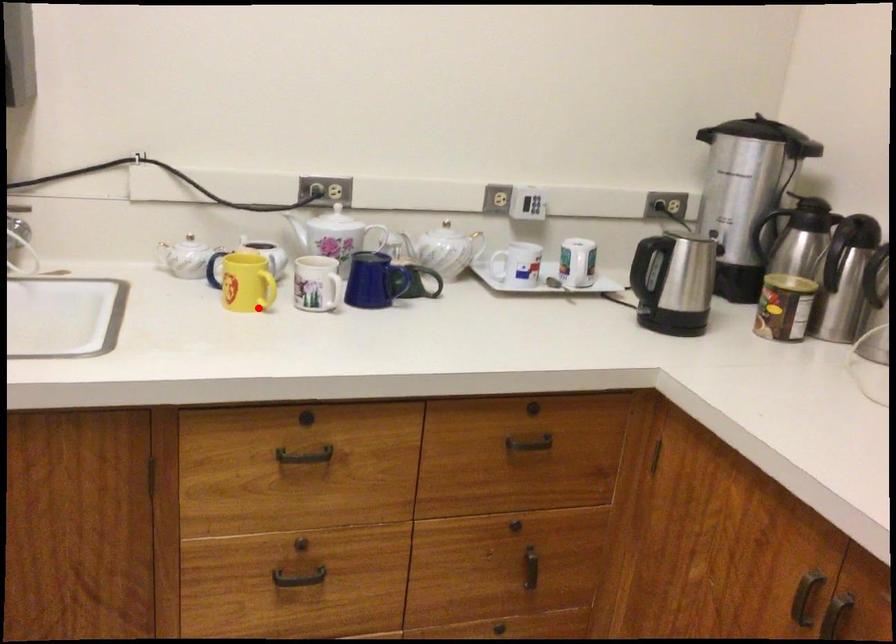
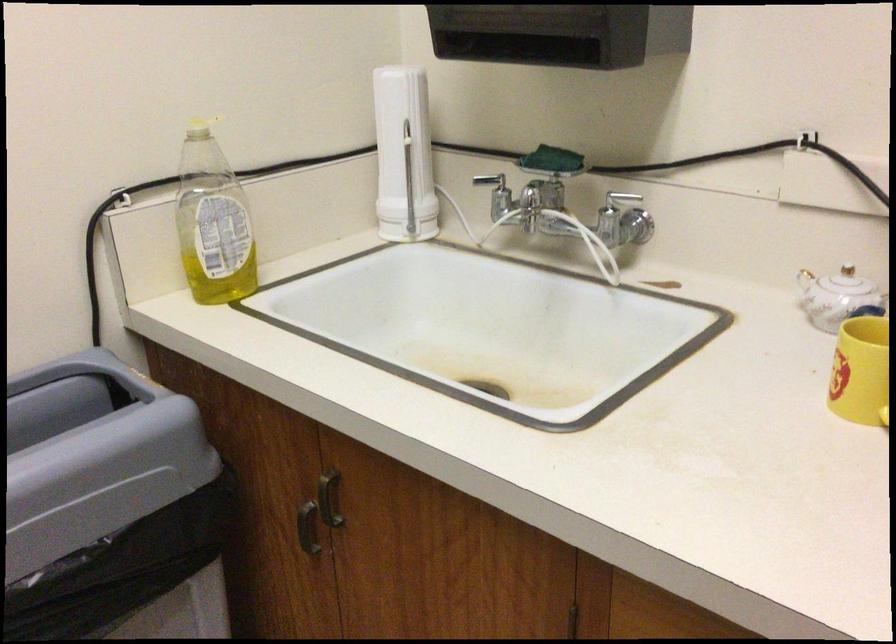
Question: I am providing you with two images of the same scene from different viewpoints. Image1 has a red point marked. In image2, the corresponding 3D location appears at what relative position? Reply with the corresponding letter.

Choices:
 (A) Closer
 (B) Farther

Answer: (A)